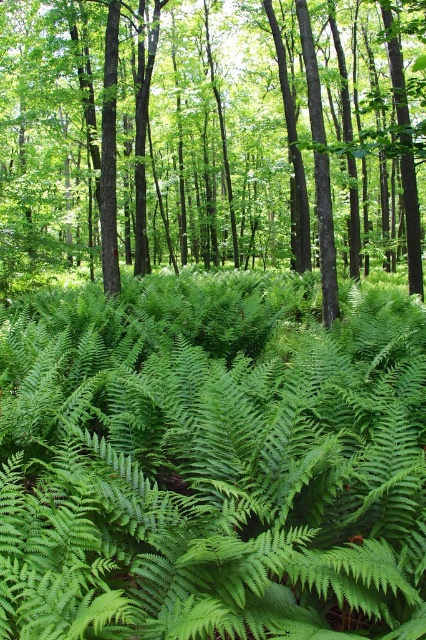
Looking at this image, who is more forward, (126, 419) or (54, 80)?

Positioned in front is point (126, 419).

Describe the element at coordinates (212, 461) in the screenshot. I see `green leafy fern at center` at that location.

Locate an element on the screen. The image size is (426, 640). green leafy fern at center is located at coordinates (212, 461).